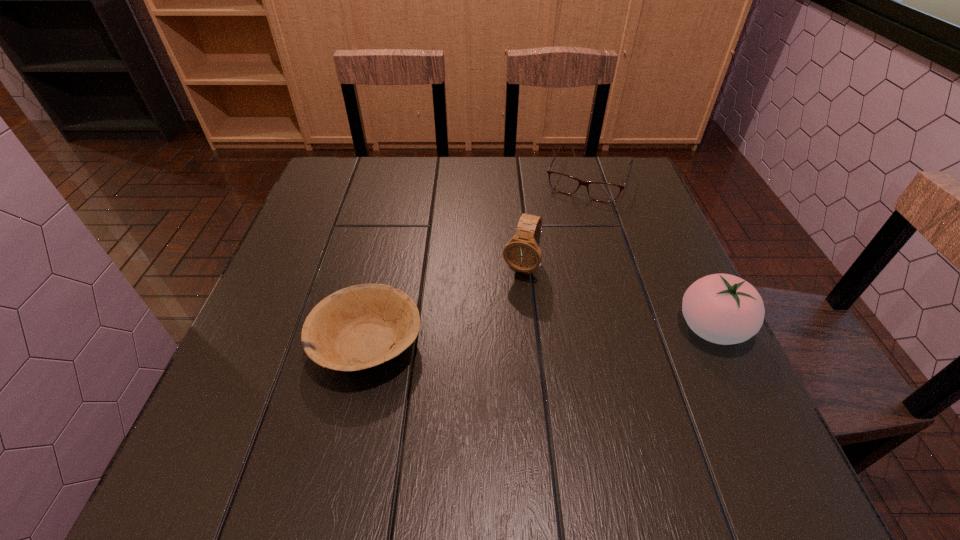
Locate an element on the screen. This screenshot has height=540, width=960. vacant space on the desktop that is between the bowl and the tomato and is positioned on the face of the watch is located at coordinates (492, 338).

The height and width of the screenshot is (540, 960). I want to click on vacant space on the desktop that is between the bowl and the tomato and is positioned on the lenses of the spectacles, so click(520, 337).